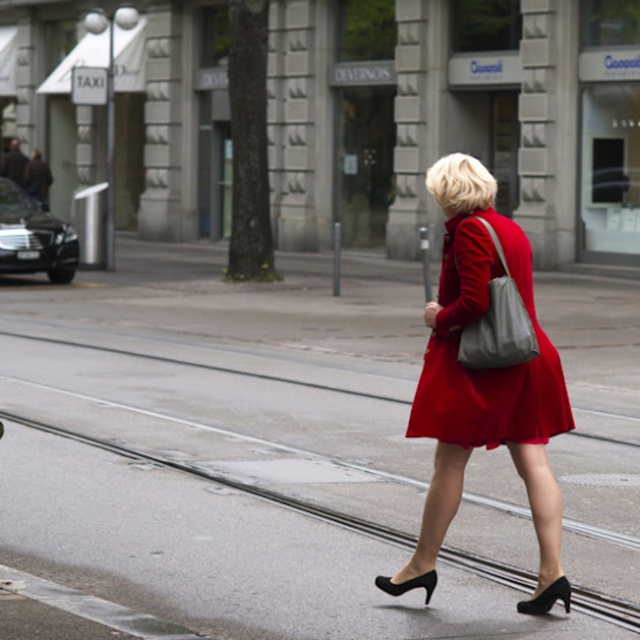
You are a fashion designer observing an urban street scene on a rainy day. You notice a woman wearing a vibrant red coat and carrying a gray shoulder bag. There is also a point marked at coordinates (490, 369). What is the significance of this point in relation to the woman?

The point (490, 369) indicates the location of the satin red dress at center, which is the woman wearing the vibrant red coat.

Please look at the image and locate the satin red dress at center. What are the exact coordinates where you can find it?

The satin red dress at center is located at coordinates point (490, 369).

You are a photographer standing at the camera position in this rainy urban scene. You want to capture a closeup shot of the satin red dress at center without moving closer than 6 meters. Is the distance sufficient for a clear closeup?

The satin red dress at center is 6.96 meters from the camera. Since the minimum required distance is 6 meters, the photographer can capture a clear closeup as the distance is sufficient.